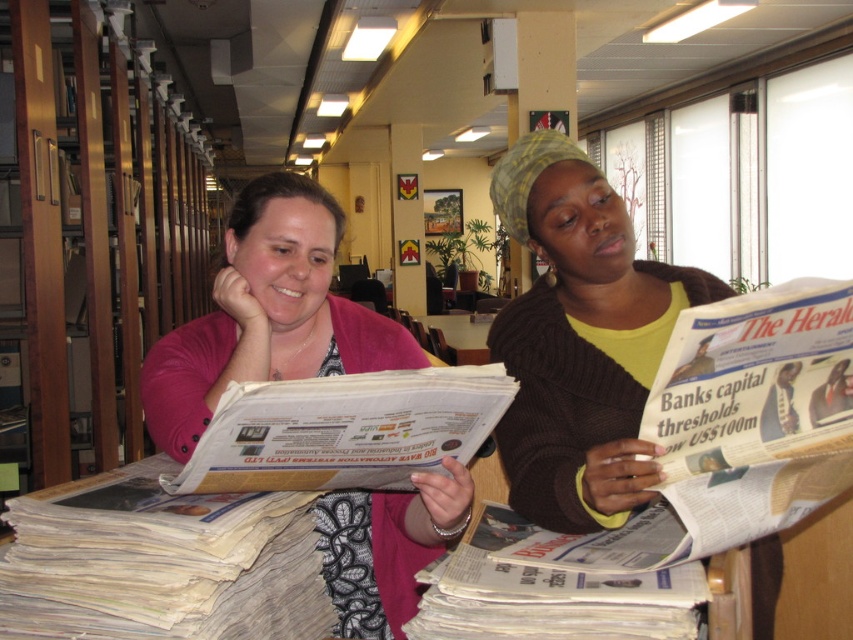
Can you confirm if pink fabric at center is positioned below white glossy newspaper at center?

Incorrect, pink fabric at center is not positioned below white glossy newspaper at center.

Locate an element on the screen. The height and width of the screenshot is (640, 853). pink fabric at center is located at coordinates (267, 314).

The image size is (853, 640). Identify the location of pink fabric at center. (267, 314).

Who is higher up, brown knitted sweater at center or white glossy newspaper at center?

brown knitted sweater at center is above.

Is point (508, 209) positioned behind point (399, 468)?

Yes.

Is point (592, 486) farther from viewer compared to point (258, 435)?

Yes, point (592, 486) is behind point (258, 435).

I want to click on brown knitted sweater at center, so click(579, 339).

Which is in front, point (660, 310) or point (247, 305)?

Point (247, 305) is more forward.

Is brown knitted sweater at center further to camera compared to pink fabric at center?

No, it is not.

Where is `brown knitted sweater at center`? The height and width of the screenshot is (640, 853). brown knitted sweater at center is located at coordinates (579, 339).